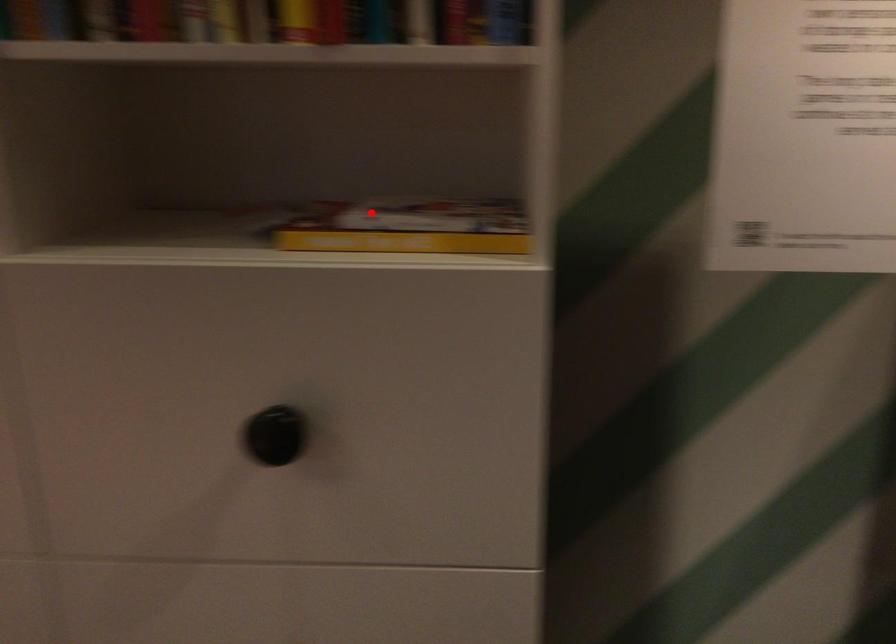
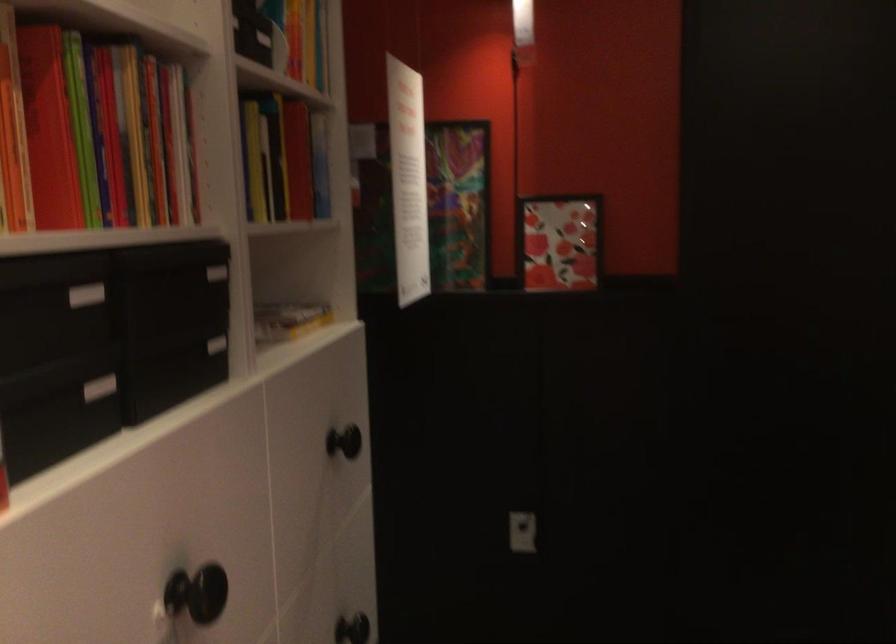
The point at the highlighted location is marked in the first image. Where is the corresponding point in the second image?

(288, 319)